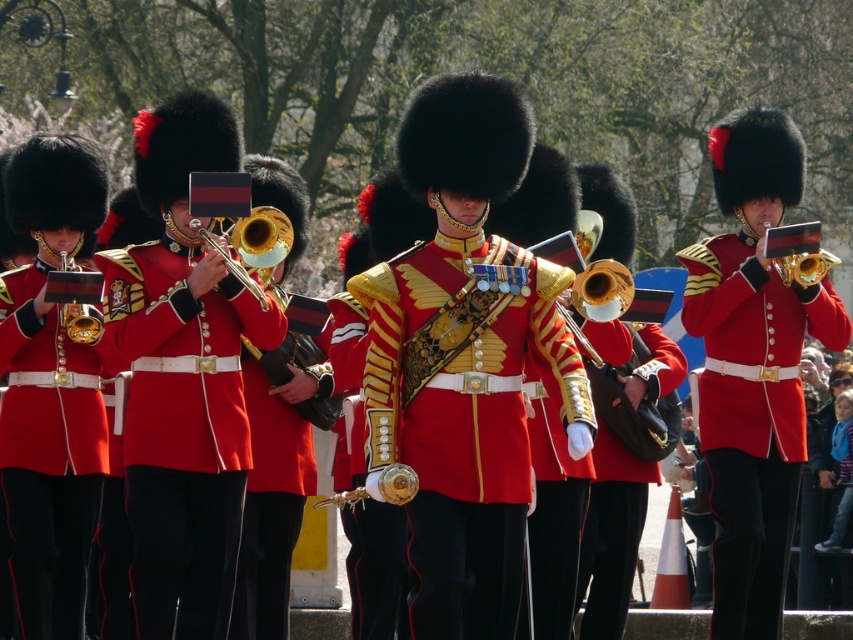
You are a photographer standing at the position of the viewer. You want to capture a closeup shot of the matte gold trumpet at left. Given that your camera has a maximum zoom range of 50 meters, will you be able to focus on the trumpet?

The matte gold trumpet at left and viewer are 45.43 meters apart from each other. Since the camera can zoom up to 50 meters, the distance of 45.43 meters is within the camera range. Therefore, the photographer can focus on the matte gold trumpet at left.

You are a photographer trying to capture a clear shot of the shiny gold uniform at center and the matte gold trumpet at left. Since you want both subjects to be in focus, which one should you focus on first to ensure the other is also sharp?

You should focus on the shiny gold uniform at center first because it is closer to you than the matte gold trumpet at left. By focusing on the closer subject, the depth of field will naturally include the farther one in the background, ensuring both are sharp.